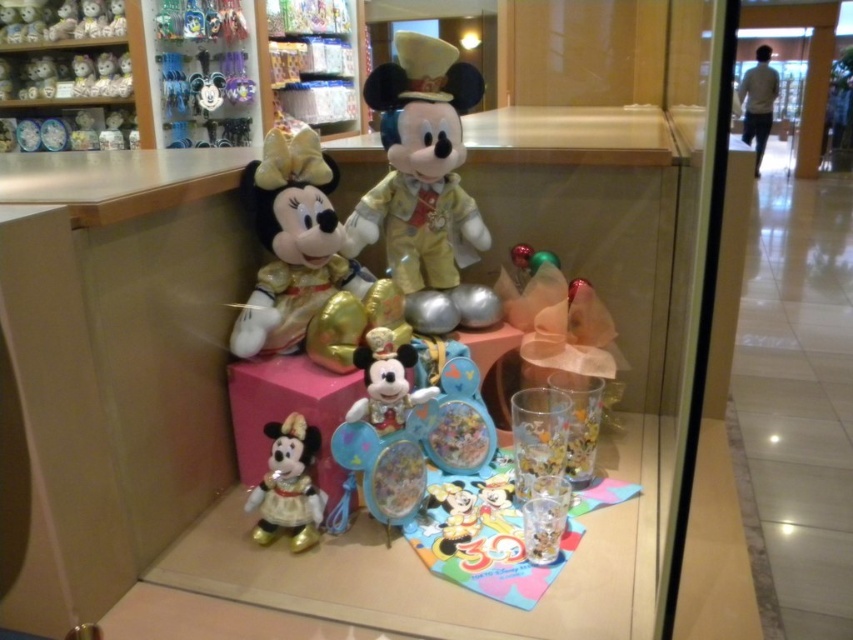
Who is lower down, gold shiny minnie mouse at lower left or matte black plush at upper left?

gold shiny minnie mouse at lower left is lower down.

Is gold shiny minnie mouse at lower left shorter than matte black plush at upper left?

Correct, gold shiny minnie mouse at lower left is not as tall as matte black plush at upper left.

Is point (276, 518) farther from camera compared to point (77, 81)?

No, (276, 518) is in front of (77, 81).

Locate an element on the screen. Image resolution: width=853 pixels, height=640 pixels. gold shiny minnie mouse at lower left is located at coordinates (288, 484).

Who is positioned more to the left, shiny gold plush at center or matte black plush at upper left?

matte black plush at upper left is more to the left.

Can you confirm if shiny gold plush at center is bigger than matte black plush at upper left?

Yes, shiny gold plush at center is bigger than matte black plush at upper left.

Does point (451, 92) come in front of point (77, 56)?

Yes, it is.

Where is `shiny gold plush at center`? The width and height of the screenshot is (853, 640). shiny gold plush at center is located at coordinates (421, 166).

Can you confirm if shiny gold plush at center is shorter than gold shiny minnie mouse at lower left?

In fact, shiny gold plush at center may be taller than gold shiny minnie mouse at lower left.

Describe the element at coordinates (421, 166) in the screenshot. This screenshot has height=640, width=853. I see `shiny gold plush at center` at that location.

At what (x,y) coordinates should I click in order to perform the action: click on shiny gold plush at center. Please return your answer as a coordinate pair (x, y). The width and height of the screenshot is (853, 640). Looking at the image, I should click on (421, 166).